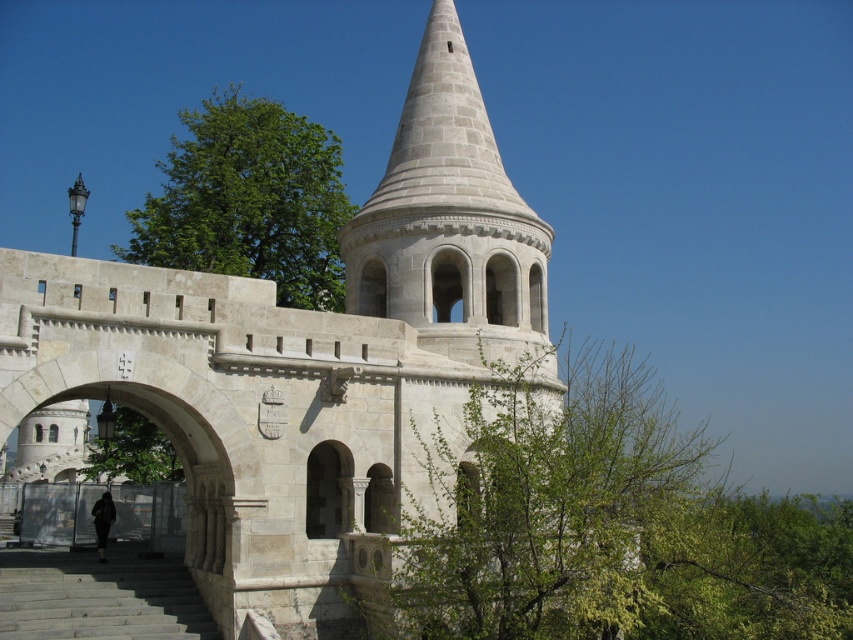
Based on the photo, measure the distance from white stone tower at center to green leafy tree at center.

The distance of white stone tower at center from green leafy tree at center is 51.44 feet.

Locate an element on the screen. white stone tower at center is located at coordinates (305, 360).

Find the location of `white stone tower at center`. white stone tower at center is located at coordinates (305, 360).

Does gray stone bell tower at center have a smaller size compared to green leafy tree at upper left?

Correct, gray stone bell tower at center occupies less space than green leafy tree at upper left.

Is gray stone bell tower at center to the right of green leafy tree at upper left from the viewer's perspective?

Yes, gray stone bell tower at center is to the right of green leafy tree at upper left.

You are a GUI agent. You are given a task and a screenshot of the screen. Output one action in this format:
    pyautogui.click(x=<x>, y=<y>)
    Task: Click on the gray stone bell tower at center
    
    Given the screenshot: What is the action you would take?
    pyautogui.click(x=448, y=218)

Who is lower down, gray stone stairs at lower left or green leafy tree at lower left?

gray stone stairs at lower left is below.

Between point (73, 637) and point (125, 440), which one is positioned behind?

Point (125, 440)

Where is `gray stone stairs at lower left`? gray stone stairs at lower left is located at coordinates (97, 596).